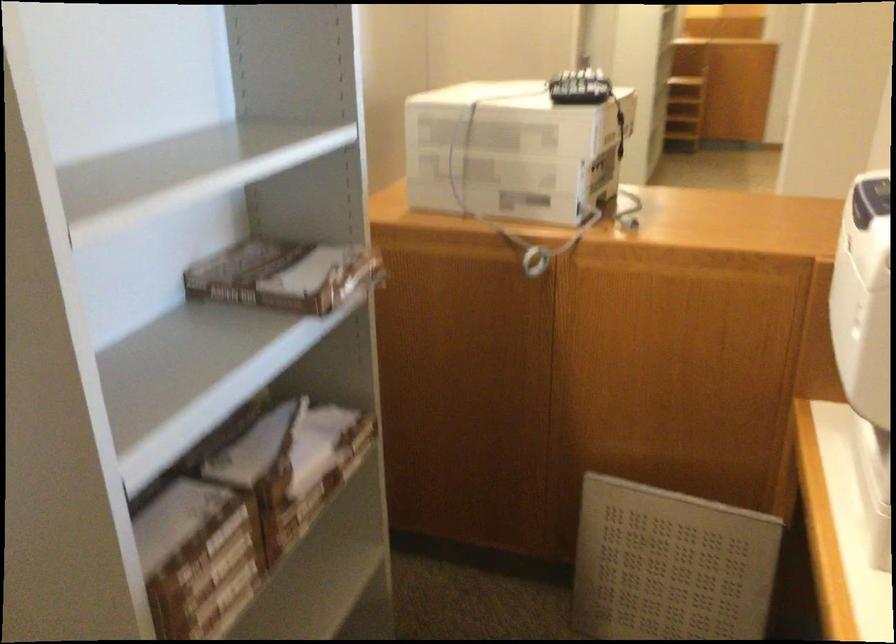
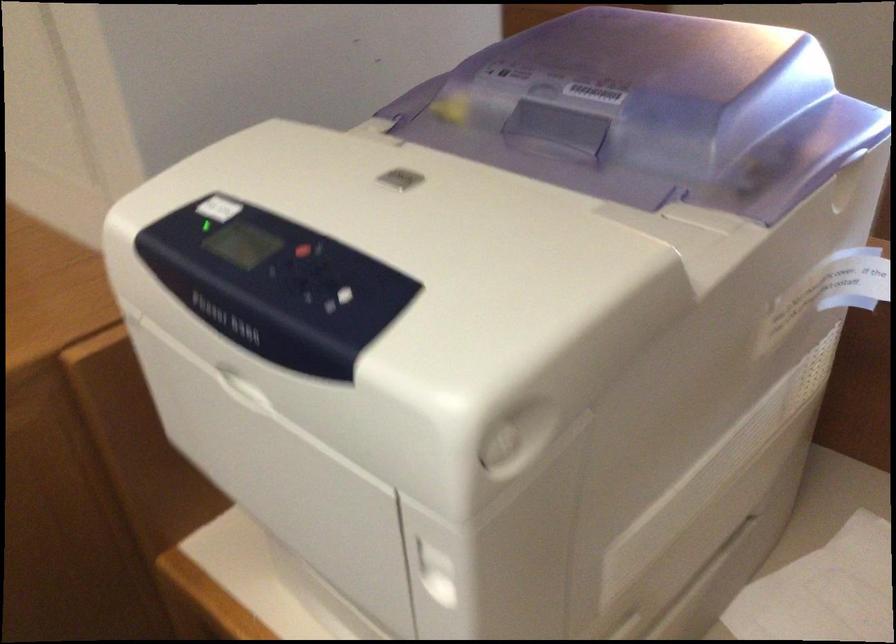
How did the camera likely rotate?

The rotation direction of the camera is right-down.